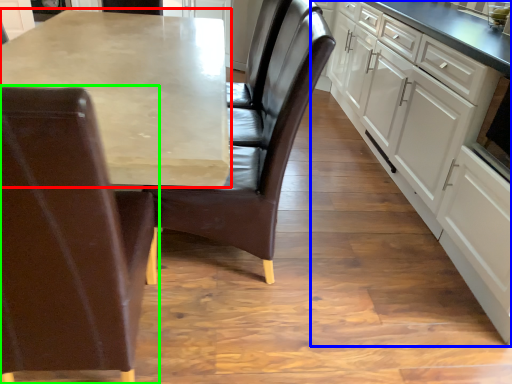
Question: Estimate the real-world distances between objects in this image. Which object is farther from countertop (highlighted by a red box), cabinetry (highlighted by a blue box) or chair (highlighted by a green box)?

Choices:
 (A) cabinetry
 (B) chair

Answer: (A)